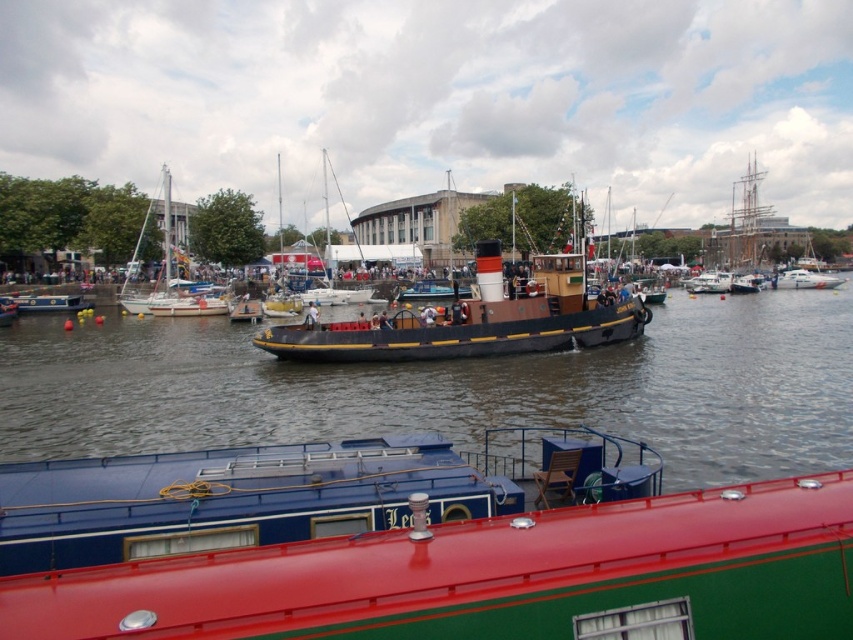
Question: Considering the real-world distances, which object is closest to the blue wooden boat at left?

Choices:
 (A) red glossy barge at center
 (B) smooth dark water at center

Answer: (B)

Question: Observing the image, what is the correct spatial positioning of blue wooden boat at left in reference to white glossy boat at right?

Choices:
 (A) left
 (B) right

Answer: (A)

Question: Among these objects, which one is nearest to the camera?

Choices:
 (A) smooth dark water at center
 (B) white sailboat at left
 (C) white glossy boat at right
 (D) red glossy barge at center

Answer: (D)

Question: Does red glossy barge at center lie behind matte black boat at center?

Choices:
 (A) no
 (B) yes

Answer: (A)

Question: Where is red glossy barge at center located in relation to white glossy boat at right in the image?

Choices:
 (A) right
 (B) left

Answer: (B)

Question: Among these objects, which one is farthest from the camera?

Choices:
 (A) brown wooden tugboat at center
 (B) white glossy boat at right
 (C) wooden sailboat at center

Answer: (B)